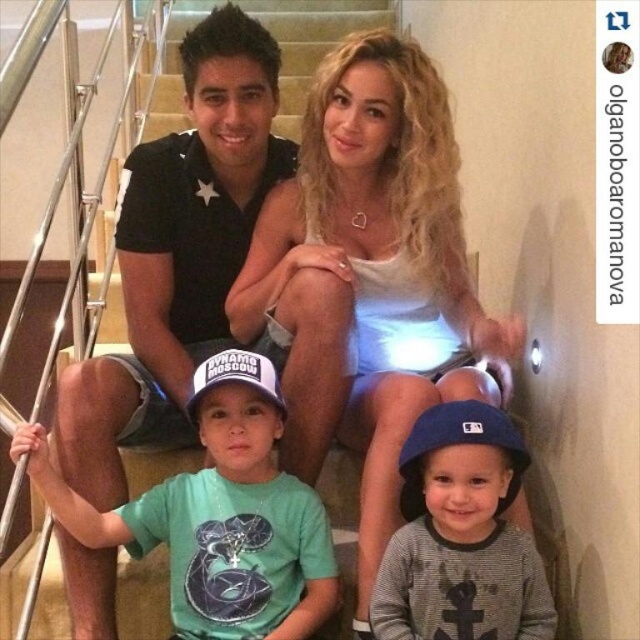
You are a photographer setting up for a family portrait. You notice the white matte dress at center and the green cotton shirt at center. Which clothing item should you focus on first to ensure it is in the foreground of the photo?

The white matte dress at center is located above the green cotton shirt at center, so focusing on the white matte dress at center first will ensure it is in the foreground.

From the picture: You are a photographer taking a picture of two people sitting on a staircase. The two people are wearing a white matte dress at center and a green cotton shirt at center. If you want to frame both of them in the same shot, will their current distance apart allow the camera to capture both comfortably?

The white matte dress at center and green cotton shirt at center are 9.93 inches apart from each other. Depending on the camera lens and framing, this distance may be close enough to include both comfortably in the shot, but it ultimately depends on the photographer adjusting the zoom or position for optimal composition.

From the picture: You are an interior designer assessing the color contrast in this modern home. The black cotton polo shirt at center and the green cotton shirt at center are part of the scene. Which of these two shirts has a darker color?

The black cotton polo shirt at center has a greater height compared to green cotton shirt at center, but the question is about color contrast. Since black is inherently darker than green, the black cotton polo shirt at center is darker in color.